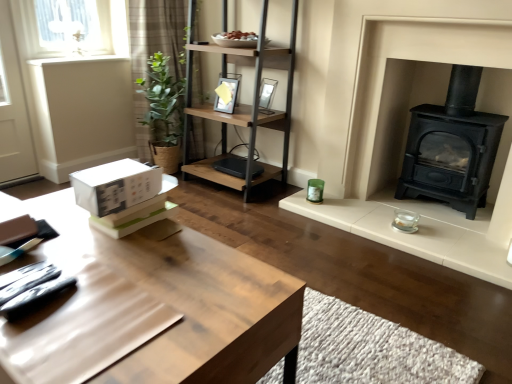
The image size is (512, 384). I want to click on free space in front of woodenmaterial/textureshelf at center, so click(x=233, y=219).